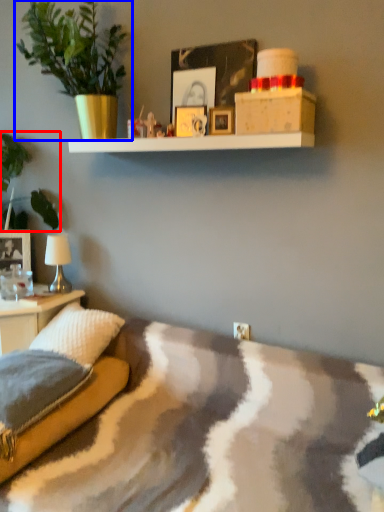
Question: Which object appears farthest to the camera in this image, plant (highlighted by a red box) or houseplant (highlighted by a blue box)?

Choices:
 (A) plant
 (B) houseplant

Answer: (A)